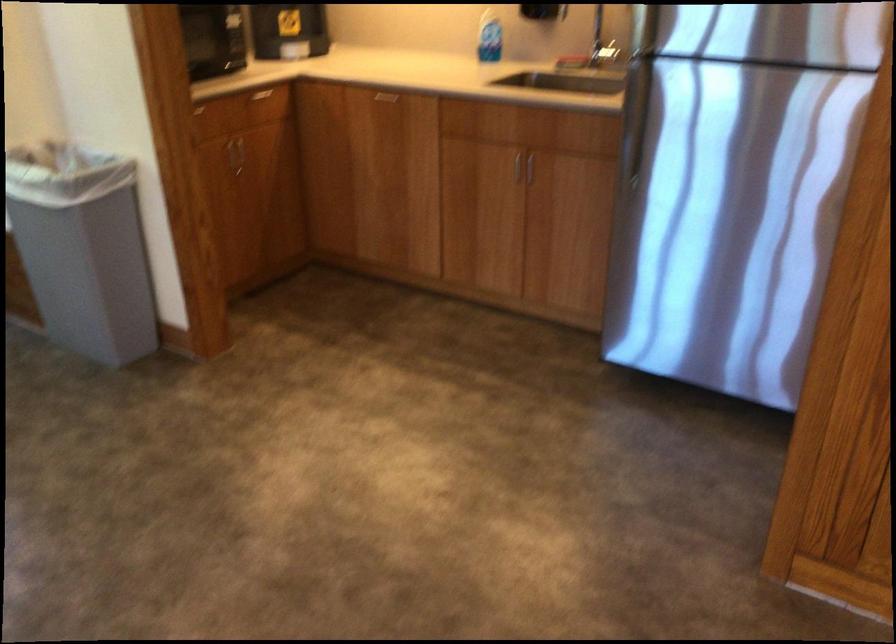
Where would you lift the faucet handle? Please return your answer as a coordinate pair (x, y).

(605, 53)